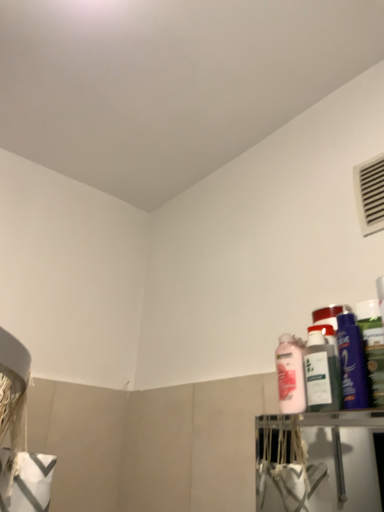
Question: Is shiny purple bottle at right, the 2th cleaning product from the right, bigger or smaller than white plastic air conditioning at upper right?

Choices:
 (A) big
 (B) small

Answer: (A)

Question: In the image, is shiny purple bottle at right, which is counted as the second cleaning product, starting from the left, on the left side or the right side of white plastic air conditioning at upper right?

Choices:
 (A) left
 (B) right

Answer: (A)

Question: Estimate the real-world distances between objects in this image. Which object is farther from the pink matte bottle at upper right?

Choices:
 (A) white plastic air conditioning at upper right
 (B) shiny purple bottle at right, which is counted as the second cleaning product, starting from the left
 (C) green matte bottle at right, which ranks as the third cleaning product in left-to-right order
 (D) pink glossy lotion at right, marked as the first cleaning product in a left-to-right arrangement

Answer: (A)

Question: Which is farther from the pink matte bottle at upper right?

Choices:
 (A) shiny purple bottle at right, which is counted as the second cleaning product, starting from the left
 (B) green matte bottle at right, which ranks as the third cleaning product in left-to-right order
 (C) white plastic air conditioning at upper right
 (D) pink glossy lotion at right, marked as the first cleaning product in a left-to-right arrangement

Answer: (C)